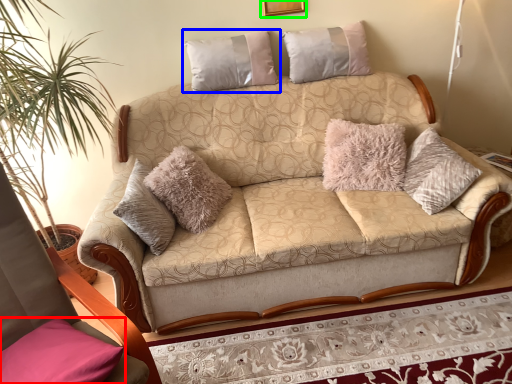
Question: Estimate the real-world distances between objects in this image. Which object is farther from pillow (highlighted by a red box), pillow (highlighted by a blue box) or picture frame (highlighted by a green box)?

Choices:
 (A) pillow
 (B) picture frame

Answer: (B)